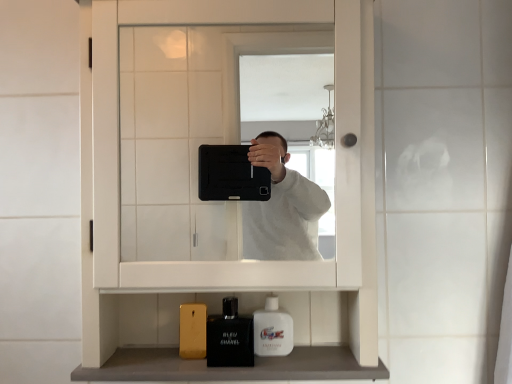
Question: From a real-world perspective, is white glossy mouthwash at lower center physically located above or below smooth gray countertop at lower center?

Choices:
 (A) below
 (B) above

Answer: (B)

Question: From the image's perspective, relative to smooth gray countertop at lower center, is white glossy mouthwash at lower center above or below?

Choices:
 (A) below
 (B) above

Answer: (B)

Question: Estimate the real-world distances between objects in this image. Which object is farther from the smooth gray countertop at lower center?

Choices:
 (A) white matte medicine cabinet at center
 (B) white glossy mouthwash at lower center
 (C) matte black perfume at lower center

Answer: (A)

Question: Estimate the real-world distances between objects in this image. Which object is farther from the smooth gray countertop at lower center?

Choices:
 (A) white glossy mouthwash at lower center
 (B) white matte medicine cabinet at center
 (C) matte black perfume at lower center

Answer: (B)